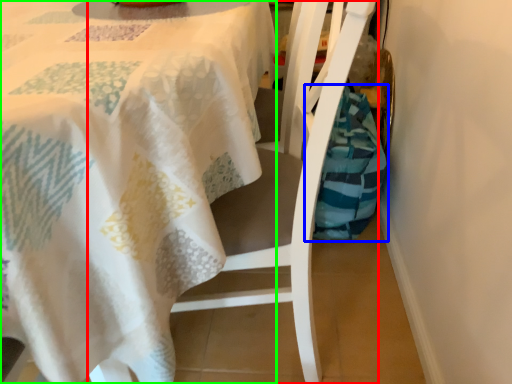
Question: Which object is positioned closest to chair (highlighted by a red box)? Select from material (highlighted by a blue box) and tablecloth (highlighted by a green box).

Choices:
 (A) material
 (B) tablecloth

Answer: (B)